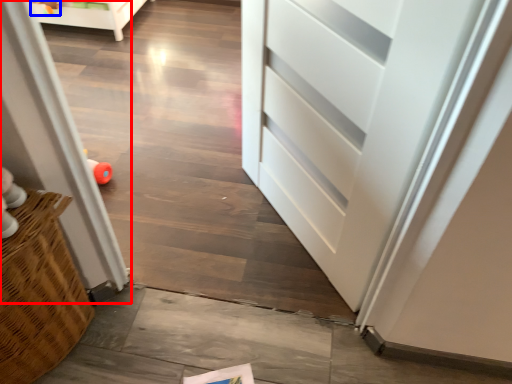
Question: Which object is closer to the camera taking this photo, screen door (highlighted by a red box) or toy (highlighted by a blue box)?

Choices:
 (A) screen door
 (B) toy

Answer: (A)